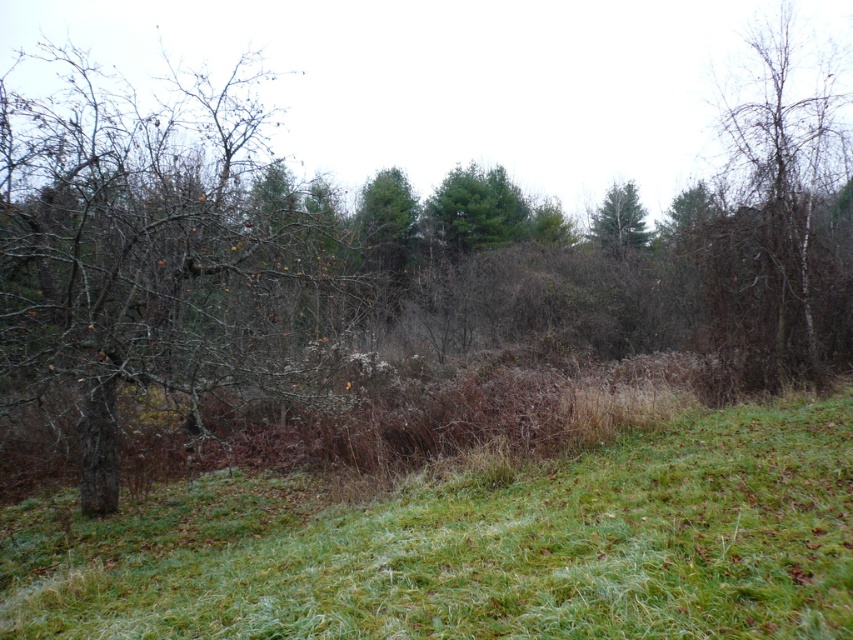
Question: Does bare branches at right appear on the right side of green matte tree at upper center?

Choices:
 (A) yes
 (B) no

Answer: (A)

Question: Among these objects, which one is farthest from the camera?

Choices:
 (A) brown bark tree at left
 (B) green grass at center
 (C) bare branches at right

Answer: (C)

Question: Which of the following is the closest to the observer?

Choices:
 (A) bare branches at right
 (B) green matte tree at upper center
 (C) green grass at center

Answer: (C)

Question: Which object appears farthest from the camera in this image?

Choices:
 (A) bare branches at right
 (B) green grass at center
 (C) brown bark tree at left
 (D) green matte tree at upper center

Answer: (D)

Question: Is green grass at center closer to the viewer compared to green matte tree at upper center?

Choices:
 (A) yes
 (B) no

Answer: (A)

Question: Can you confirm if bare branches at right is thinner than green matte tree at upper center?

Choices:
 (A) no
 (B) yes

Answer: (A)